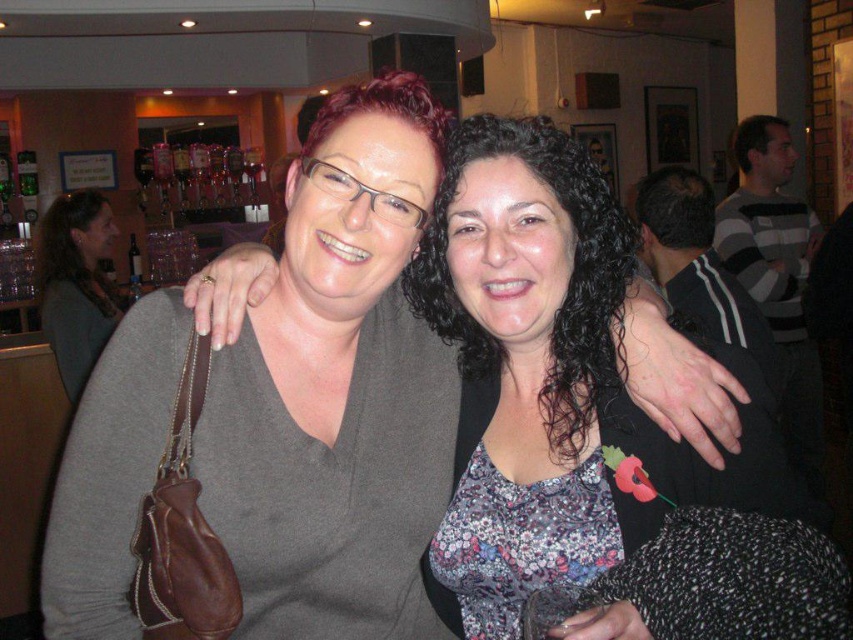
You are at a social event and want to approach the person wearing the matte gray sweater at center and the matte gray sweater at left. Which one should you walk towards first if you want to greet them in order from closest to farthest?

You should first walk towards the matte gray sweater at center since it is closer to you than the matte gray sweater at left, so greeting them in order from closest to farthest would start with the matte gray sweater at center.

You are a photographer at an event and need to adjust the lighting so that both the matte gray sweater at center and the matte gray sweater at left are equally illuminated. Given their sizes, which sweater requires more light to appear properly lit?

The matte gray sweater at left requires more light because it is taller than the matte gray sweater at center, so it needs more illumination to ensure proper lighting coverage.

You are a fashion designer observing two women wearing matte gray sweaters in the image. The one on the left is wearing a matte gray sweater at left, and the one on the right is wearing a matte gray sweater at center. Which sweater is larger?

The matte gray sweater at left is larger than the matte gray sweater at center.